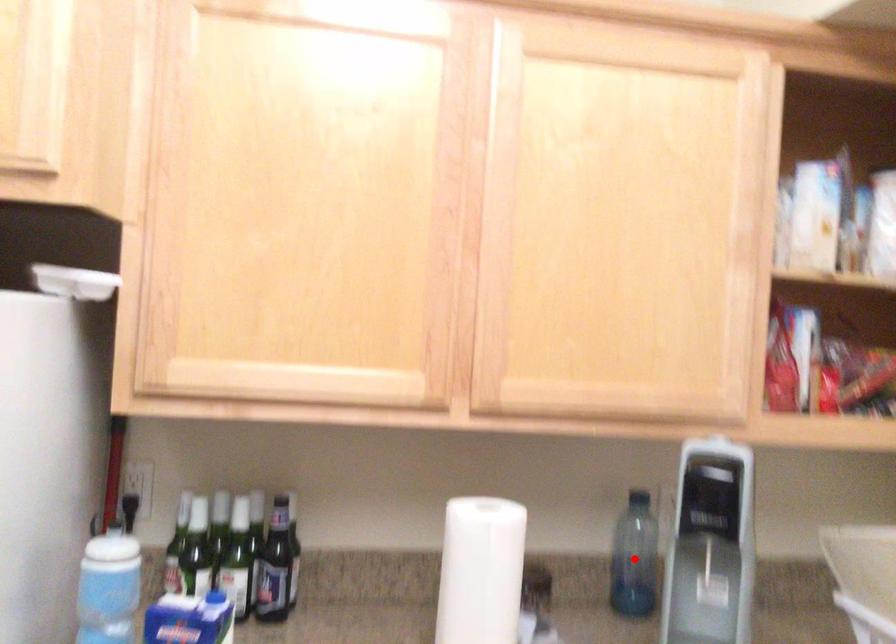
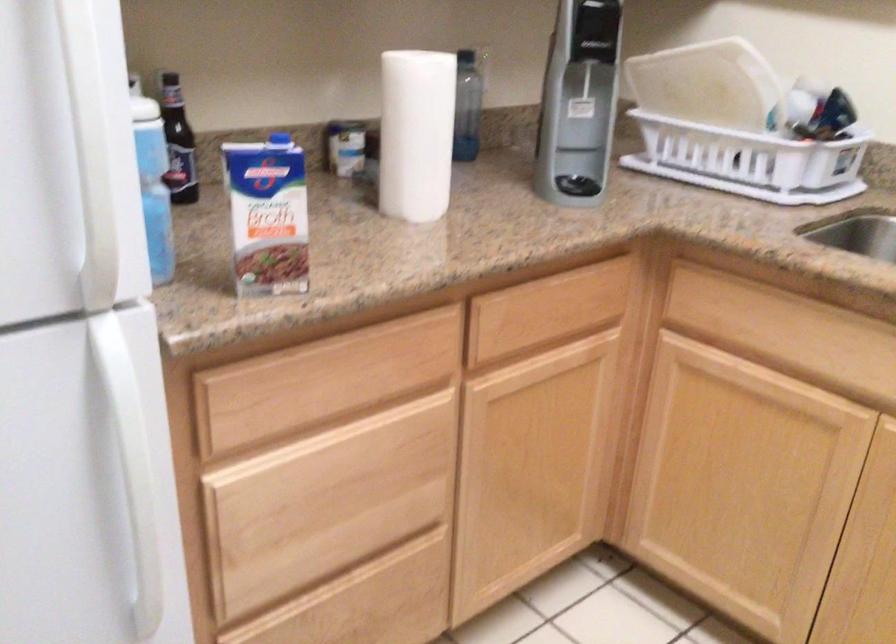
Question: I am providing you with two images of the same scene from different viewpoints. A red point is marked on the first image. Is the red point's position out of view in image 2?

Choices:
 (A) Yes
 (B) No

Answer: (A)